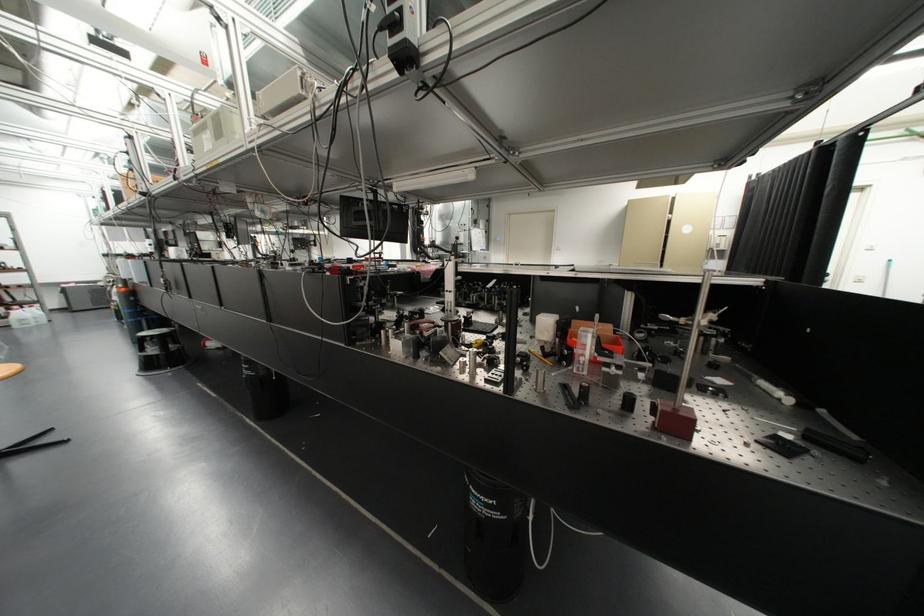
Where would you pull the white door handle? Please return your answer as a coordinate pair (x, y).

(920, 272)